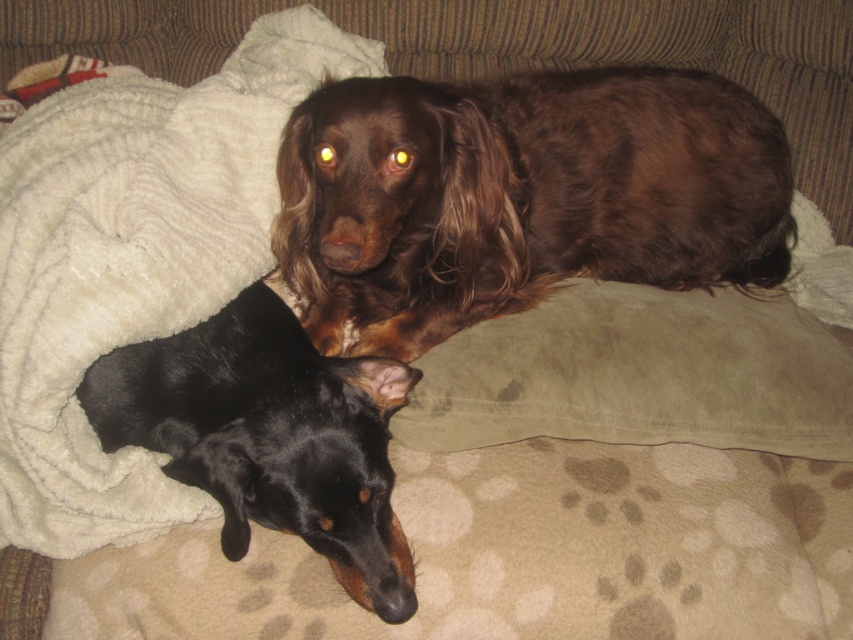
Does point (318, 177) lie in front of point (82, 289)?

No.

Can you confirm if brown furry dog at upper center is positioned above white fluffy blanket at lower left?

Correct, brown furry dog at upper center is located above white fluffy blanket at lower left.

Between point (376, 289) and point (248, 259), which one is positioned behind?

Point (376, 289)

Find the location of a particular element. brown furry dog at upper center is located at coordinates (520, 196).

Which of these two, white fluffy blanket at lower left or suede-like brown pillow at upper right, stands taller?

Standing taller between the two is white fluffy blanket at lower left.

Based on the photo, is white fluffy blanket at lower left to the left of suede-like brown pillow at upper right from the viewer's perspective?

Correct, you'll find white fluffy blanket at lower left to the left of suede-like brown pillow at upper right.

Between point (267, 230) and point (772, 440), which one is positioned in front?

Point (772, 440) is in front.

Where is `white fluffy blanket at lower left`? The width and height of the screenshot is (853, 640). white fluffy blanket at lower left is located at coordinates (132, 260).

Between white fluffy blanket at lower left and black smooth dog at lower left, which one is positioned higher?

white fluffy blanket at lower left is higher up.

At what (x,y) coordinates should I click in order to perform the action: click on white fluffy blanket at lower left. Please return your answer as a coordinate pair (x, y). This screenshot has width=853, height=640. Looking at the image, I should click on [x=132, y=260].

Where is `white fluffy blanket at lower left`? white fluffy blanket at lower left is located at coordinates (132, 260).